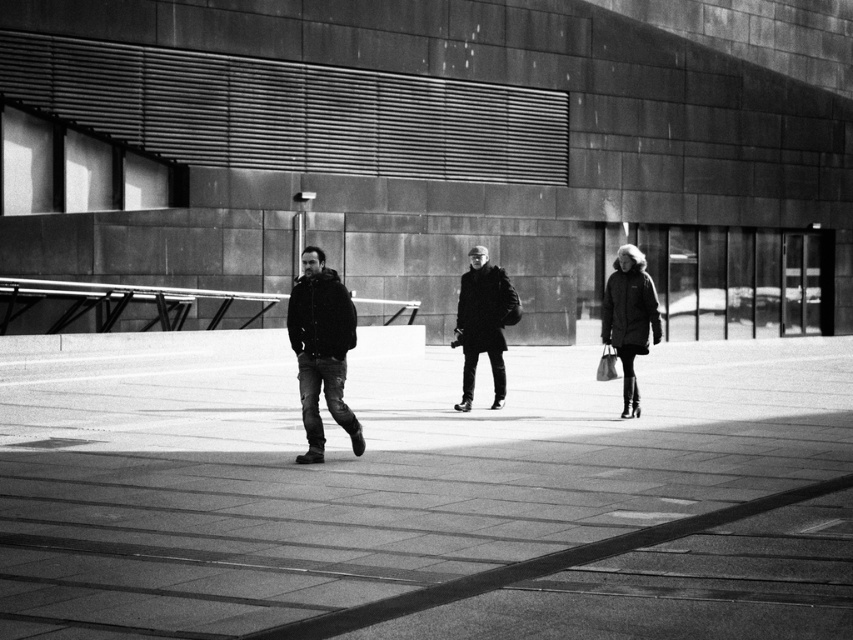
Looking at this image, you are standing in front of the modern building and see the point marked at coordinates (354, 422). If you want to walk directly to that point, how far will you have to walk?

The point at coordinates (354, 422) is 45.22 feet away from the viewer, so you will have to walk 45.22 feet to reach it.

You are a photographer trying to capture a clear shot of the dark gray jeans at center and the black matte coat at center. Since you want to focus on the taller object, which one should you adjust your camera to focus on?

The black matte coat at center is taller than the dark gray jeans at center, so you should adjust your camera to focus on the black matte coat at center.

You are a photographer trying to capture a photo of the dark gray jeans at center and the matte black coat at right. Based on their sizes in the image, which one would appear larger in your photo?

The dark gray jeans at center would appear larger in the photo because it is much taller than the matte black coat at right.